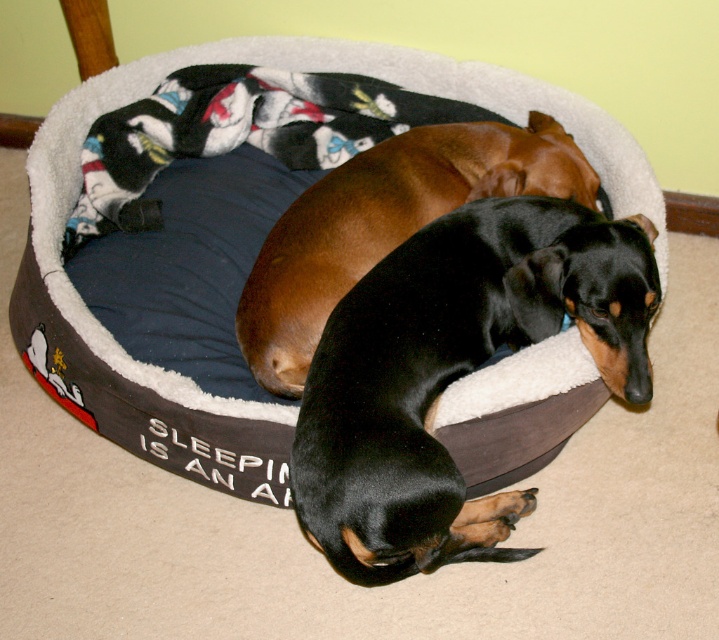
You are a dog owner who wants to place a new water bowl for your dachshunds. The bowl requires a space of 0.15 units in diameter. Is there enough space on the dark gray plush dog bed at center to place the bowl without overlapping the edges?

The dark gray plush dog bed at center has a 2D location at point (226, 253). Since the bowl requires 0.15 units in diameter, and the bed is circular, the bowl can be placed in the center area without overlapping the edges as long as the bed has sufficient radius. However, the exact radius of the bed is not provided, so we cannot confirm the availability of space.

You are a dog owner who wants to ensure both dogs have enough space to rest comfortably. Given that the black smooth dog at center is thinner than the brown smooth dog at center, which dog requires more space in the dog bed?

The brown smooth dog at center requires more space in the dog bed because it is thicker than the black smooth dog at center.